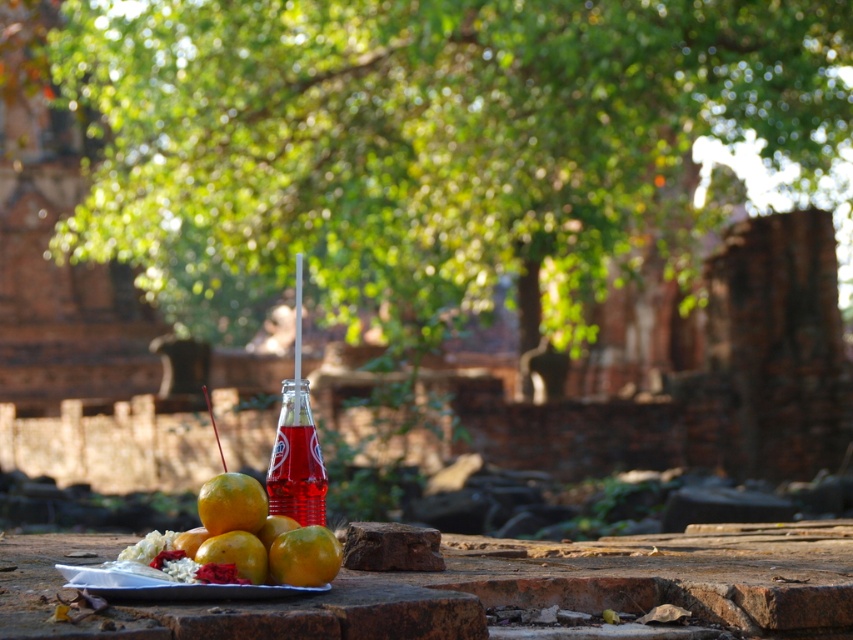
You are standing at the entrance of the temple complex and see the point marked by coordinates point (296, 460). What object is located at that point?

The translucent glass bottle at center is located at point (296, 460).

You are standing in the temple complex and want to take a photo of both the green leafy tree at center and the shiny yellow orange at center. Which object should you focus on first to ensure both are in the frame?

You should focus on the green leafy tree at center first because it is closer to you than the shiny yellow orange at center, ensuring both are in the frame.